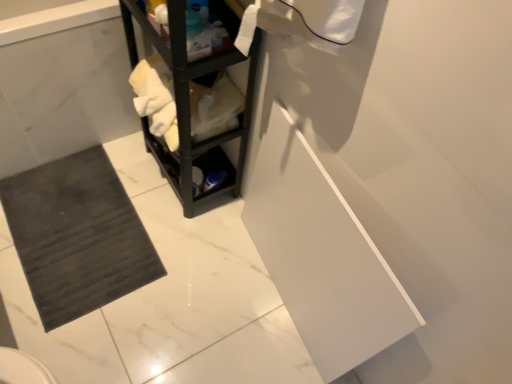
Question: From the image's perspective, is black matte shelf at center located beneath dark gray rubber bath mat at lower left?

Choices:
 (A) no
 (B) yes

Answer: (A)

Question: Is black matte shelf at center smaller than dark gray rubber bath mat at lower left?

Choices:
 (A) yes
 (B) no

Answer: (B)

Question: Is black matte shelf at center located outside dark gray rubber bath mat at lower left?

Choices:
 (A) yes
 (B) no

Answer: (A)

Question: Is black matte shelf at center touching dark gray rubber bath mat at lower left?

Choices:
 (A) no
 (B) yes

Answer: (A)

Question: Does black matte shelf at center have a greater height compared to dark gray rubber bath mat at lower left?

Choices:
 (A) yes
 (B) no

Answer: (A)

Question: Considering the positions of black matte shelf at center and dark gray rubber bath mat at lower left in the image, is black matte shelf at center bigger or smaller than dark gray rubber bath mat at lower left?

Choices:
 (A) big
 (B) small

Answer: (A)

Question: From their relative heights in the image, would you say black matte shelf at center is taller or shorter than dark gray rubber bath mat at lower left?

Choices:
 (A) short
 (B) tall

Answer: (B)

Question: Relative to dark gray rubber bath mat at lower left, is black matte shelf at center in front or behind?

Choices:
 (A) behind
 (B) front

Answer: (B)

Question: From the image's perspective, relative to dark gray rubber bath mat at lower left, is black matte shelf at center above or below?

Choices:
 (A) above
 (B) below

Answer: (B)

Question: From the image's perspective, is dark gray rubber bath mat at lower left above or below dark gray rubber bath mat at lower left?

Choices:
 (A) above
 (B) below

Answer: (A)

Question: Considering the positions of point (79, 145) and point (58, 284), is point (79, 145) closer or farther from the camera than point (58, 284)?

Choices:
 (A) closer
 (B) farther

Answer: (B)

Question: From a real-world perspective, is dark gray rubber bath mat at lower left above or below dark gray rubber bath mat at lower left?

Choices:
 (A) above
 (B) below

Answer: (A)

Question: Considering the positions of dark gray rubber bath mat at lower left and dark gray rubber bath mat at lower left in the image, is dark gray rubber bath mat at lower left bigger or smaller than dark gray rubber bath mat at lower left?

Choices:
 (A) small
 (B) big

Answer: (B)

Question: From the image's perspective, is dark gray rubber bath mat at lower left above or below dark gray rubber bath mat at lower left?

Choices:
 (A) above
 (B) below

Answer: (B)

Question: Considering the positions of dark gray rubber bath mat at lower left and dark gray rubber bath mat at lower left in the image, is dark gray rubber bath mat at lower left bigger or smaller than dark gray rubber bath mat at lower left?

Choices:
 (A) big
 (B) small

Answer: (B)